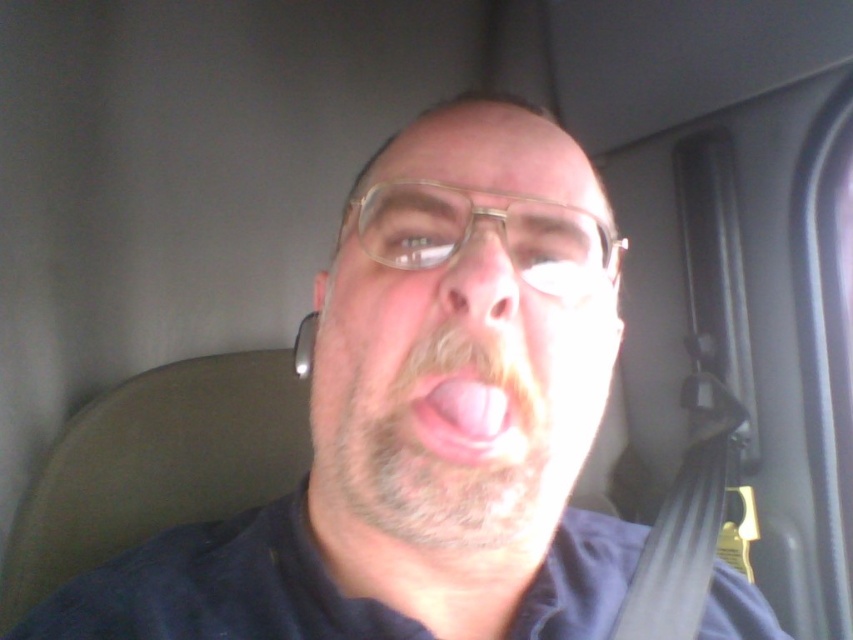
You are a photographer adjusting the lighting in a car interior. You notice two areas of the subject, the smooth skin face at center and the pink flesh at center. Which one is positioned to the left?

The smooth skin face at center is to the left of the pink flesh at center.

You are a photographer trying to capture the best angle of the person in the car. Since the smooth skin face at center and the pink flesh at center are both visible, which one should you focus on to ensure the subject is properly framed?

The smooth skin face at center is located above the pink flesh at center, so focusing on the smooth skin face at center will ensure the subject is properly framed as it is the main facial feature.

You are a photographer taking a portrait of the person in the car. The car window is causing glare on their face. To reduce the glare, you need to position your camera so that it is not directly facing the light source. Given the smooth skin face at center is located at point 0.620, 0.530, where should you position your camera relative to the face to avoid the glare?

To avoid the glare on the smooth skin face at center, position the camera slightly to the left or right of the face, ensuring it is not directly aligned with the light source coming through the window. Since the face is at coordinates (x=451, y=396), moving the camera position away from the light source direction would help reduce glare.